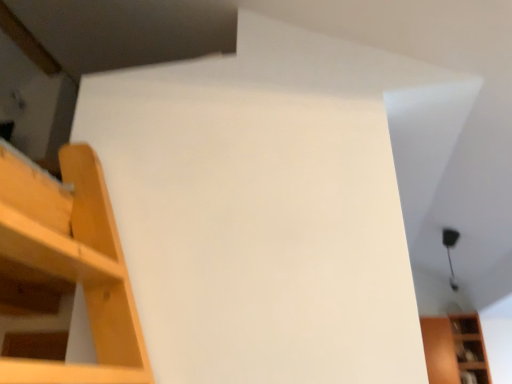
In order to face wooden at lower right, should I rotate leftwards or rightwards?

Turn right by 25.939 degrees to look at wooden at lower right.

Identify the location of wooden at lower right. The image size is (512, 384). (454, 349).

This screenshot has width=512, height=384. Describe the element at coordinates (454, 349) in the screenshot. I see `wooden at lower right` at that location.

Find the location of a particular element. wooden at lower right is located at coordinates (454, 349).